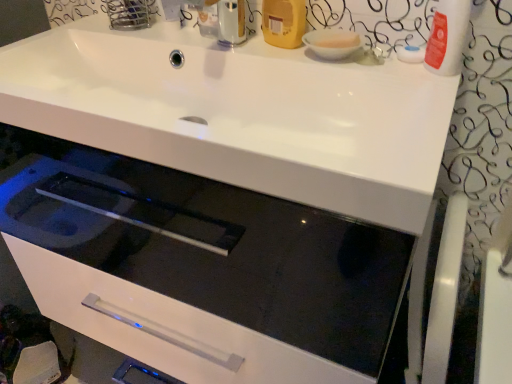
Question: Is white ceramic bowl at upper right wider or thinner than yellow matte plastic bottle at upper right?

Choices:
 (A) wide
 (B) thin

Answer: (A)

Question: Is white ceramic bowl at upper right in front of or behind yellow matte plastic bottle at upper right in the image?

Choices:
 (A) front
 (B) behind

Answer: (A)

Question: Would you say white ceramic bowl at upper right is inside or outside yellow matte plastic bottle at upper right?

Choices:
 (A) outside
 (B) inside

Answer: (A)

Question: Looking at their shapes, would you say yellow matte plastic bottle at upper right is wider or thinner than white ceramic bowl at upper right?

Choices:
 (A) thin
 (B) wide

Answer: (A)

Question: From a real-world perspective, relative to white ceramic bowl at upper right, is yellow matte plastic bottle at upper right vertically above or below?

Choices:
 (A) above
 (B) below

Answer: (A)

Question: Considering the positions of point (304, 31) and point (328, 56), is point (304, 31) closer or farther from the camera than point (328, 56)?

Choices:
 (A) farther
 (B) closer

Answer: (A)

Question: In terms of height, does yellow matte plastic bottle at upper right look taller or shorter compared to white ceramic bowl at upper right?

Choices:
 (A) short
 (B) tall

Answer: (B)